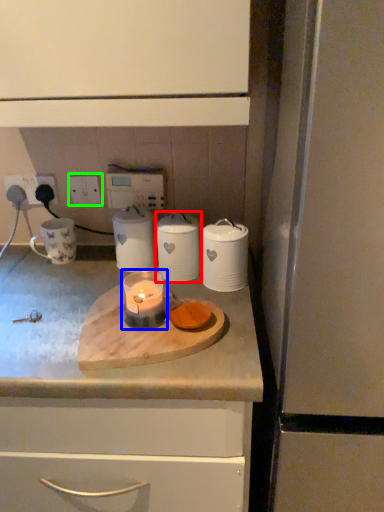
Question: Estimate the real-world distances between objects in this image. Which object is closer to kitchen appliance (highlighted by a red box), candle holder (highlighted by a blue box) or electric outlet (highlighted by a green box)?

Choices:
 (A) candle holder
 (B) electric outlet

Answer: (A)